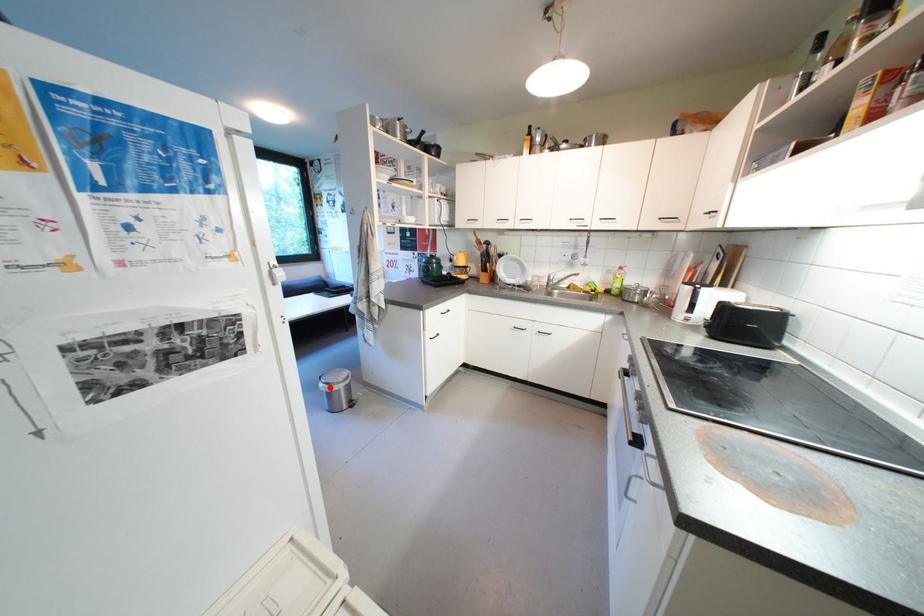
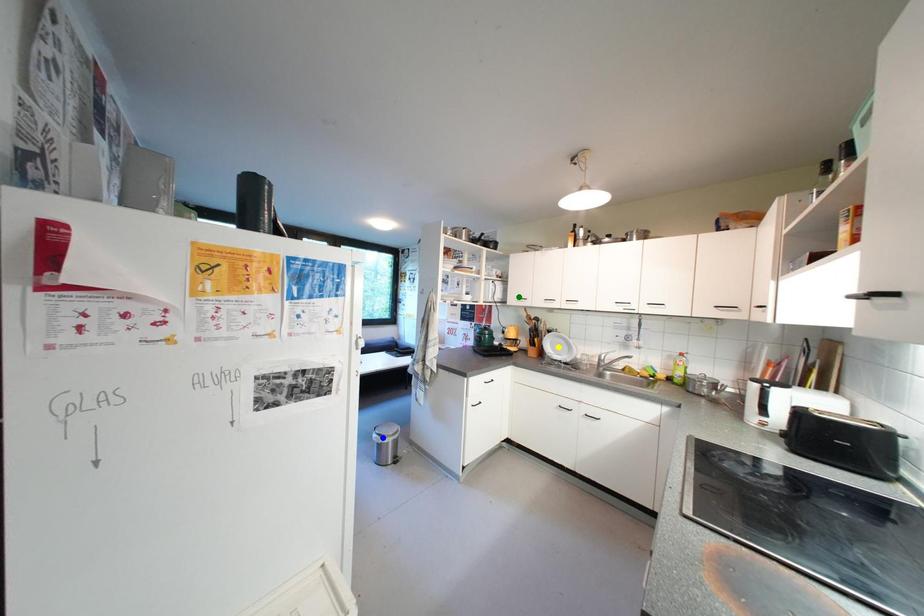
Question: I am providing you with two images of the same scene from different viewpoints. A red point is marked on the first image. You are given multiple points on the second image. Which point in image 2 represents the same 3d spot as the red point in image 1?

Choices:
 (A) yellow point
 (B) green point
 (C) blue point

Answer: (C)